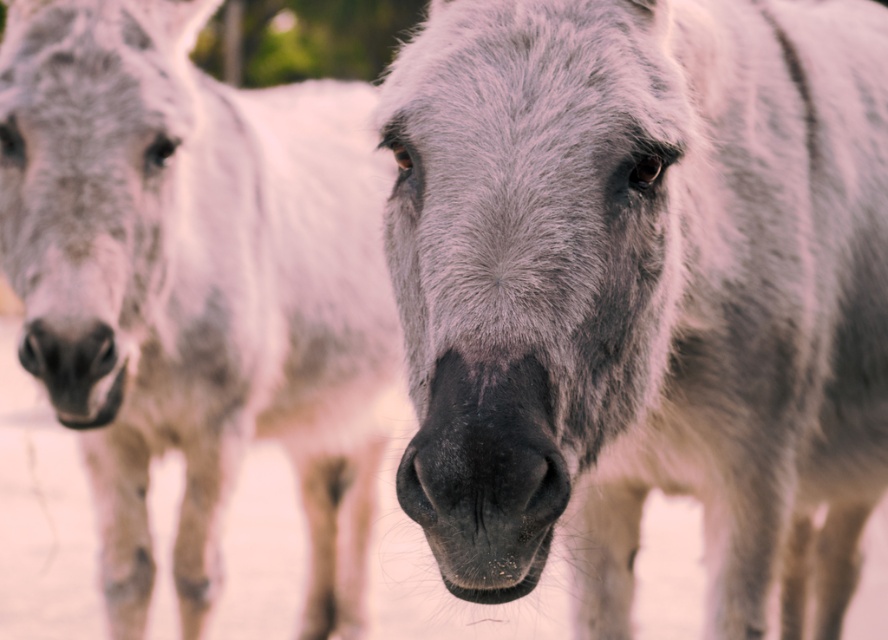
Who is positioned more to the left, fuzzy white donkey at center or gray matte donkey at center?

gray matte donkey at center

Does fuzzy white donkey at center appear over gray matte donkey at center?

No, fuzzy white donkey at center is not above gray matte donkey at center.

Does point (533, 36) come closer to viewer compared to point (139, 602)?

Yes, it is in front of point (139, 602).

I want to click on fuzzy white donkey at center, so click(641, 289).